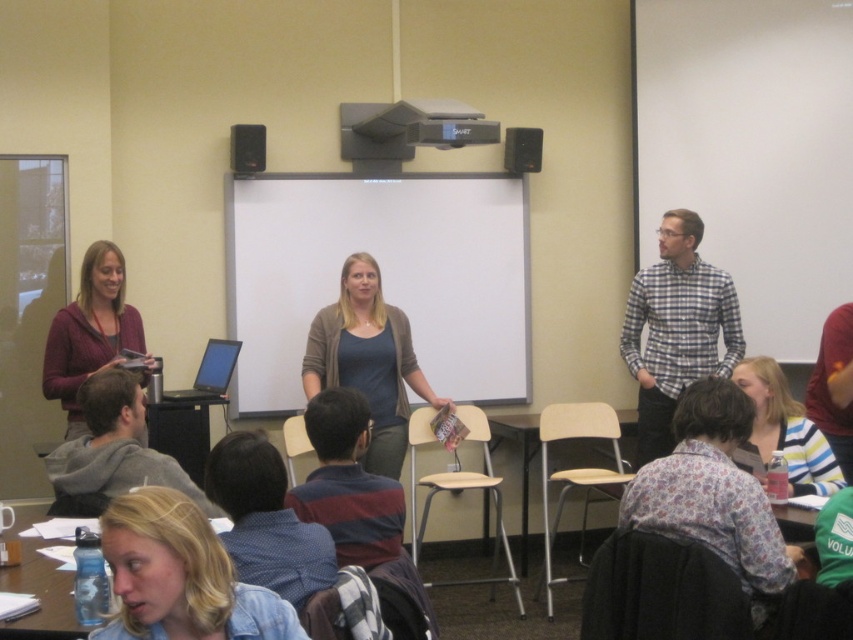
You are a photographer positioned at the back of the classroom. You want to take a photo of the checkered fabric shirt at right and the matte black speaker at upper center. Which object will appear larger in your photo?

The checkered fabric shirt at right will appear larger in the photo because it is closer to the viewer than the matte black speaker at upper center.

From the picture: You are standing in the classroom and want to locate the matte gray sweater at center. What are the coordinates where you should look?

The matte gray sweater at center is located at coordinates point (367, 360).